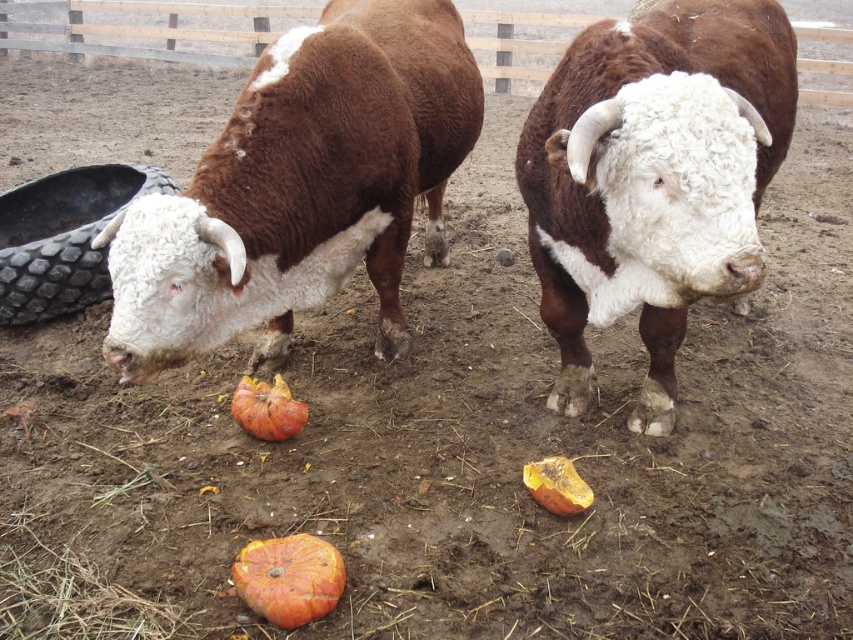
You are a farmer who wants to choose the bigger cow for breeding. You have two options in the image, the brown woolly bull at left and the brown woolly bull at center. Which one should you choose?

The brown woolly bull at left is larger in size compared to the brown woolly bull at center, so you should choose the brown woolly bull at left for breeding.

You are standing at the origin point in the farmyard. Where is the brown woolly bull at center located in terms of coordinates?

The brown woolly bull at center is located at coordinates point [653,179].

You are a farmer who wants to separate the brown woolly bull at left from the orange rough pumpkin at center using a fence. Based on their positions, which side of the pumpkin should the fence be placed on to keep the bull away?

The brown woolly bull at left is to the left of the orange rough pumpkin at center, so placing the fence to the left side of the pumpkin would keep the bull away.